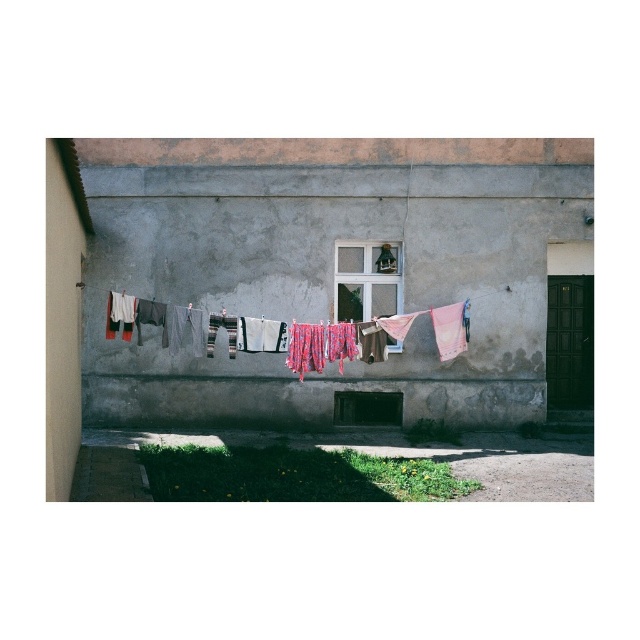
Who is more forward, (x=349, y=352) or (x=387, y=340)?

Point (x=349, y=352)

Is multicolored fabric at center below clear glass window at center?

Correct, multicolored fabric at center is located below clear glass window at center.

Locate an element on the screen. The width and height of the screenshot is (640, 640). multicolored fabric at center is located at coordinates click(371, 339).